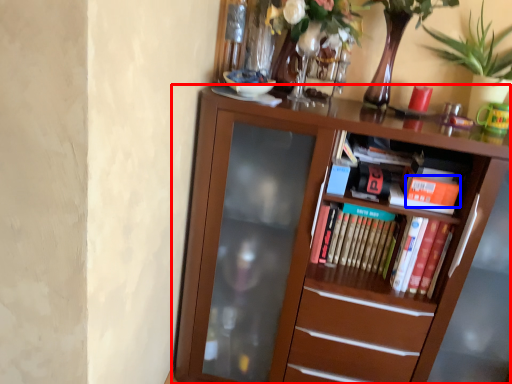
Question: Which object appears farthest to the camera in this image, bookcase (highlighted by a red box) or paperback book (highlighted by a blue box)?

Choices:
 (A) bookcase
 (B) paperback book

Answer: (B)